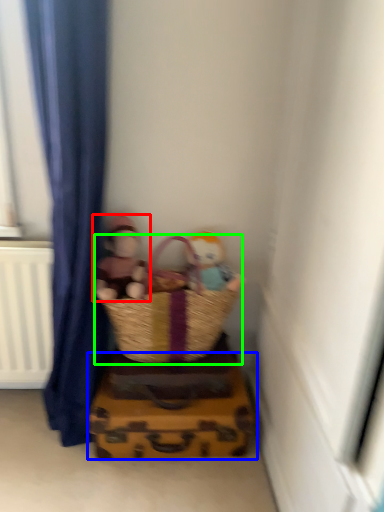
Question: Considering the real-world distances, which object is farthest from person (highlighted by a red box)? crate (highlighted by a blue box) or picnic basket (highlighted by a green box)?

Choices:
 (A) crate
 (B) picnic basket

Answer: (A)